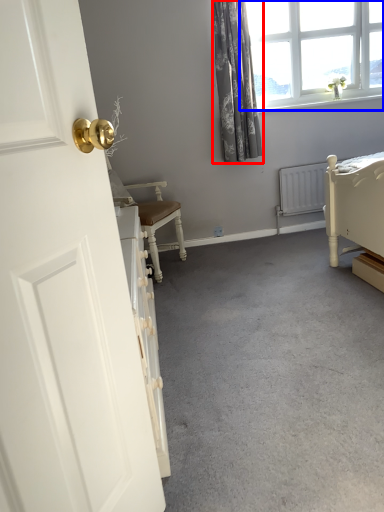
Question: Which point is closer to the camera, curtain (highlighted by a red box) or window (highlighted by a blue box)?

Choices:
 (A) curtain
 (B) window

Answer: (A)